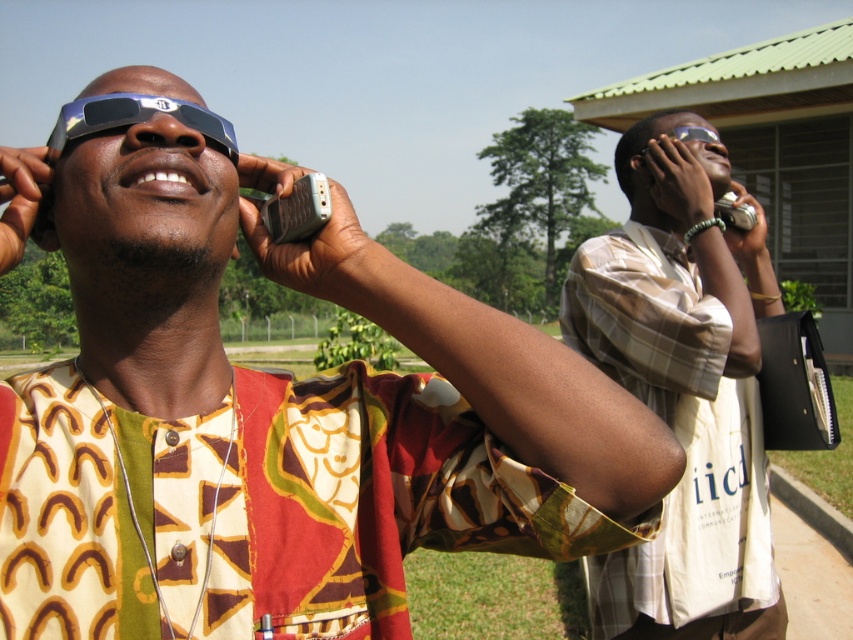
Question: Which point is closer to the camera?

Choices:
 (A) transparent plastic goggles at upper center
 (B) matte plastic sunglasses at upper left
 (C) plaid shirt at center

Answer: (B)

Question: Is plaid shirt at center closer to the viewer compared to transparent plastic goggles at upper center?

Choices:
 (A) yes
 (B) no

Answer: (A)

Question: Is blue reflective glasses at upper center positioned in front of transparent plastic goggles at upper center?

Choices:
 (A) yes
 (B) no

Answer: (A)

Question: Estimate the real-world distances between objects in this image. Which object is farther from the transparent plastic goggles at upper center?

Choices:
 (A) matte plastic sunglasses at upper left
 (B) plaid shirt at center

Answer: (A)

Question: Can you confirm if plaid shirt at center is wider than transparent plastic goggles at upper center?

Choices:
 (A) no
 (B) yes

Answer: (B)

Question: Which of the following is the farthest from the observer?

Choices:
 (A) plaid shirt at center
 (B) transparent plastic goggles at upper center
 (C) blue reflective glasses at upper center
 (D) matte plastic sunglasses at upper left

Answer: (B)